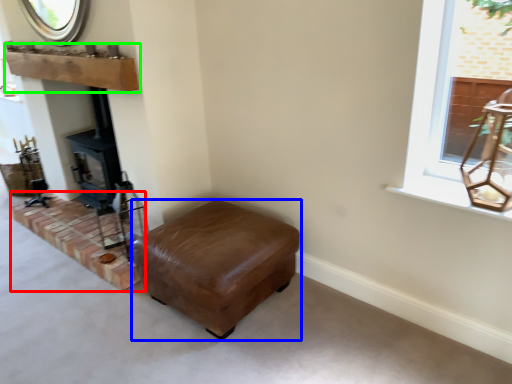
Question: Which object is the farthest from brickwork (highlighted by a red box)? Choose among these: furniture (highlighted by a blue box) or mantle (highlighted by a green box).

Choices:
 (A) furniture
 (B) mantle

Answer: (B)